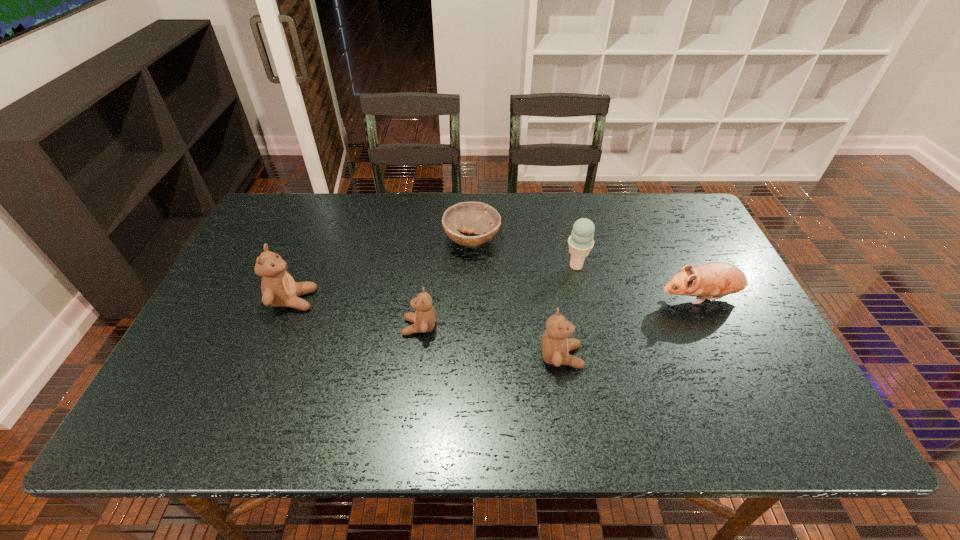
Where is `free point between the ice cream and the fifth object from right to left`? This screenshot has height=540, width=960. free point between the ice cream and the fifth object from right to left is located at coordinates (498, 296).

Locate an element on the screen. vacant space that's between the leftmost object and the bowl is located at coordinates (383, 270).

At what (x,y) coordinates should I click in order to perform the action: click on vacant space in between the third object from left to right and the hamster. Please return your answer as a coordinate pair (x, y). The image size is (960, 540). Looking at the image, I should click on (587, 269).

Find the location of a particular element. Image resolution: width=960 pixels, height=540 pixels. unoccupied position between the rightmost teddy bear and the ice cream is located at coordinates (568, 311).

At what (x,y) coordinates should I click in order to perform the action: click on empty location between the second teddy bear from left to right and the bowl. Please return your answer as a coordinate pair (x, y). This screenshot has height=540, width=960. Looking at the image, I should click on (445, 284).

The image size is (960, 540). In order to click on free area in between the ice cream and the second object from left to right in this screenshot , I will do tap(498, 296).

The width and height of the screenshot is (960, 540). What are the coordinates of `vacant space in between the rightmost teddy bear and the shortest teddy bear` in the screenshot? It's located at (491, 342).

The width and height of the screenshot is (960, 540). Identify the location of the fourth closest object to the rightmost object. (424, 318).

You are a GUI agent. You are given a task and a screenshot of the screen. Output one action in this format:
    pyautogui.click(x=<x>, y=<y>)
    Task: Click on the second closest object to the rightmost object
    The image size is (960, 540).
    Given the screenshot: What is the action you would take?
    pyautogui.click(x=555, y=346)

Select which teddy bear appears as the closest to the second object from left to right. Please provide its 2D coordinates. Your answer should be formatted as a tuple, i.e. [(x, y)], where the tuple contains the x and y coordinates of a point satisfying the conditions above.

[(279, 289)]